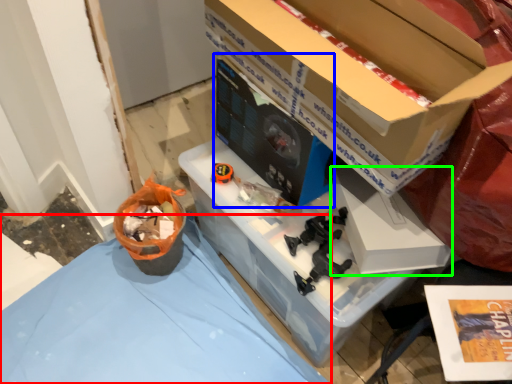
Question: Considering the real-world distances, which object is farthest from tablecloth (highlighted by a red box)? desktop computer (highlighted by a blue box) or box (highlighted by a green box)?

Choices:
 (A) desktop computer
 (B) box

Answer: (B)